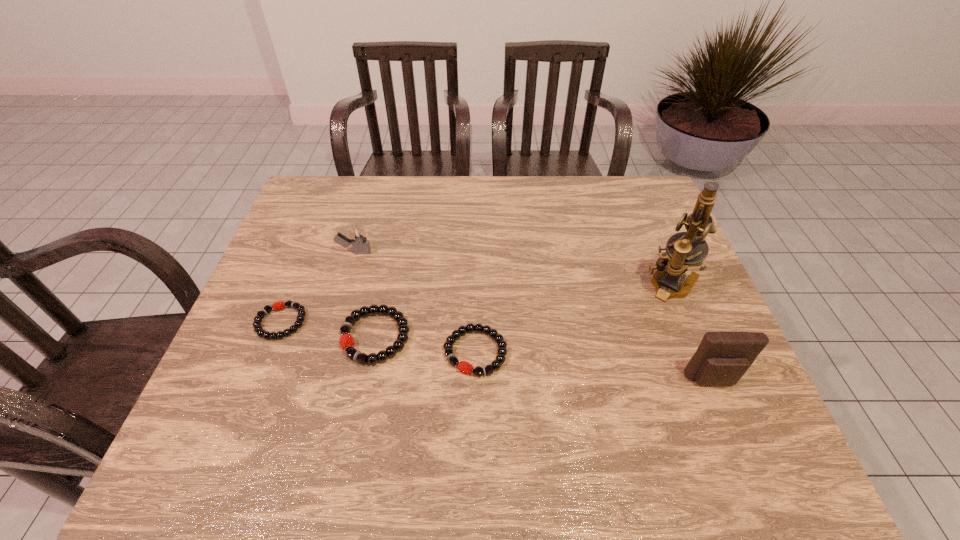
Where is `free space between the rightmost bracelet and the shortest bracelet`? free space between the rightmost bracelet and the shortest bracelet is located at coordinates (378, 337).

Identify the location of empty space that is in between the second shortest bracelet and the third tallest object. The image size is (960, 540). (415, 302).

Identify the location of free spot between the tallest object and the second bracelet from right to left. This screenshot has height=540, width=960. (523, 310).

This screenshot has height=540, width=960. What are the coordinates of `vacant area that lies between the igniter and the tallest object` in the screenshot? It's located at (514, 268).

Locate an element on the screen. Image resolution: width=960 pixels, height=540 pixels. vacant area that lies between the microscope and the second bracelet from right to left is located at coordinates (523, 310).

This screenshot has width=960, height=540. I want to click on vacant area that lies between the farthest object and the leftmost bracelet, so click(x=318, y=287).

Find the location of a particular element. Image resolution: width=960 pixels, height=540 pixels. vacant region between the microscope and the second shortest object is located at coordinates (573, 318).

The height and width of the screenshot is (540, 960). I want to click on the third closest object relative to the microscope, so pos(347,344).

At what (x,y) coordinates should I click in order to perform the action: click on object that ranks as the fifth closest to the second shortest bracelet. Please return your answer as a coordinate pair (x, y). This screenshot has width=960, height=540. Looking at the image, I should click on (722, 358).

Where is `bracelet that stands as the closest to the second bracelet from right to left`? bracelet that stands as the closest to the second bracelet from right to left is located at coordinates (465, 367).